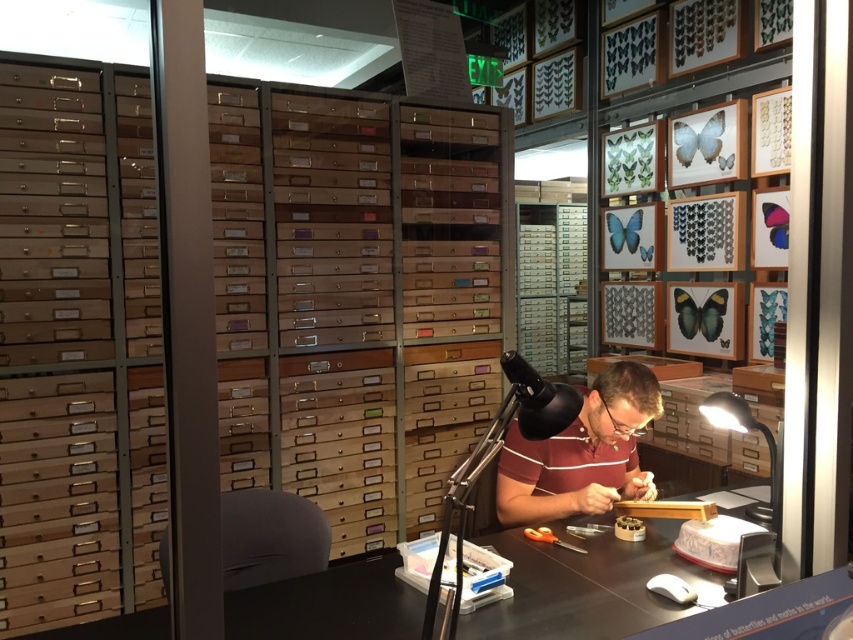
From the picture: You are standing in the museum and want to get a closer look at the wooden desk at center. The maroon striped shirt at center is blocking your view. Can you walk around the shirt to see the desk better?

The wooden desk at center is closer to the viewer than the maroon striped shirt at center, so you can walk around the shirt to get a better view of the desk.

You are standing in the museum and want to observe the specimen the man is working on. The specimen is located at point [280,609]. If you are 1.56 meters away from this point, can you clearly see the specimen without moving closer?

Yes, because the distance between you and the specimen at point [280,609] is exactly 1.56 meters, which allows for clear observation without needing to move closer.